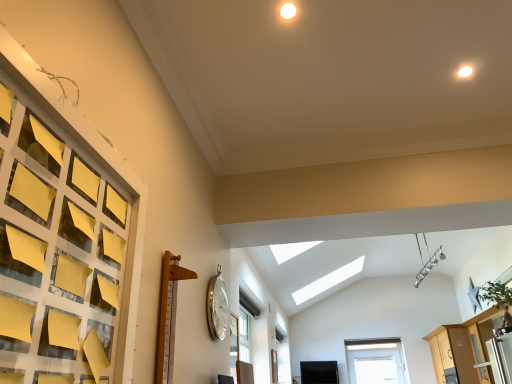
What do you see at coordinates (217, 307) in the screenshot? The height and width of the screenshot is (384, 512). I see `silver metallic clock at upper center` at bounding box center [217, 307].

Find the location of a particular element. The height and width of the screenshot is (384, 512). silver metallic clock at upper center is located at coordinates (217, 307).

Measure the distance between silver metallic clock at upper center and camera.

silver metallic clock at upper center and camera are 2.22 meters apart.

The height and width of the screenshot is (384, 512). Identify the location of wooden dresser at lower right. (462, 349).

Describe the element at coordinates (462, 349) in the screenshot. I see `wooden dresser at lower right` at that location.

This screenshot has height=384, width=512. In order to click on silver metallic clock at upper center in this screenshot , I will do `click(217, 307)`.

Which object is positioned more to the right, silver metallic clock at upper center or wooden dresser at lower right?

wooden dresser at lower right is more to the right.

Which object is more forward, silver metallic clock at upper center or wooden dresser at lower right?

silver metallic clock at upper center is in front.

Which is closer, [223,321] or [444,352]?

Point [223,321] is closer to the camera than point [444,352].

From the image's perspective, is silver metallic clock at upper center over wooden dresser at lower right?

Yes, from the image's perspective, silver metallic clock at upper center is over wooden dresser at lower right.

From a real-world perspective, is silver metallic clock at upper center physically below wooden dresser at lower right?

No, from a real-world perspective, silver metallic clock at upper center is not beneath wooden dresser at lower right.

Looking at their sizes, would you say silver metallic clock at upper center is wider or thinner than wooden dresser at lower right?

Clearly, silver metallic clock at upper center has less width compared to wooden dresser at lower right.

Is silver metallic clock at upper center shorter than wooden dresser at lower right?

Yes, silver metallic clock at upper center is shorter than wooden dresser at lower right.

Who is bigger, silver metallic clock at upper center or wooden dresser at lower right?

Bigger between the two is wooden dresser at lower right.

Would you say silver metallic clock at upper center is inside or outside wooden dresser at lower right?

silver metallic clock at upper center is spatially situated outside wooden dresser at lower right.

Is silver metallic clock at upper center next to wooden dresser at lower right?

silver metallic clock at upper center is not next to wooden dresser at lower right, and they're not touching.

Is silver metallic clock at upper center facing towards wooden dresser at lower right?

No, silver metallic clock at upper center is not turned towards wooden dresser at lower right.

How different are the orientations of silver metallic clock at upper center and wooden dresser at lower right in degrees?

There is a 180-degree angle between the facing directions of silver metallic clock at upper center and wooden dresser at lower right.

The width and height of the screenshot is (512, 384). I want to click on clock on the left of wooden dresser at lower right, so click(x=217, y=307).

Considering the relative positions of wooden dresser at lower right and silver metallic clock at upper center in the image provided, is wooden dresser at lower right to the left or to the right of silver metallic clock at upper center?

Clearly, wooden dresser at lower right is on the right of silver metallic clock at upper center in the image.

Is the depth of wooden dresser at lower right greater than that of silver metallic clock at upper center?

Yes, it is behind silver metallic clock at upper center.

Does point (458, 378) lie behind point (214, 278)?

Yes, it is.

From the image's perspective, is wooden dresser at lower right positioned above or below silver metallic clock at upper center?

Based on their image positions, wooden dresser at lower right is located beneath silver metallic clock at upper center.

Based on the photo, from a real-world perspective, does wooden dresser at lower right stand above silver metallic clock at upper center?

No.

Does wooden dresser at lower right have a lesser width compared to silver metallic clock at upper center?

No, wooden dresser at lower right is not thinner than silver metallic clock at upper center.

Considering the sizes of objects wooden dresser at lower right and silver metallic clock at upper center in the image provided, who is shorter, wooden dresser at lower right or silver metallic clock at upper center?

silver metallic clock at upper center is shorter.

Who is smaller, wooden dresser at lower right or silver metallic clock at upper center?

With smaller size is silver metallic clock at upper center.

Is silver metallic clock at upper center located within wooden dresser at lower right?

No.

Are wooden dresser at lower right and silver metallic clock at upper center located far from each other?

Indeed, wooden dresser at lower right is not near silver metallic clock at upper center.

Is wooden dresser at lower right aimed at silver metallic clock at upper center?

No, wooden dresser at lower right is not oriented towards silver metallic clock at upper center.

How different are the orientations of wooden dresser at lower right and silver metallic clock at upper center in degrees?

180 degrees separate the facing orientations of wooden dresser at lower right and silver metallic clock at upper center.

How much distance is there between wooden dresser at lower right and silver metallic clock at upper center?

wooden dresser at lower right and silver metallic clock at upper center are 9.41 feet apart.

This screenshot has width=512, height=384. I want to click on dresser on the right of silver metallic clock at upper center, so click(x=462, y=349).

Identify the location of dresser that is on the right side of silver metallic clock at upper center. (462, 349).

Locate an element on the screen. clock that appears above the wooden dresser at lower right (from a real-world perspective) is located at coordinates (217, 307).